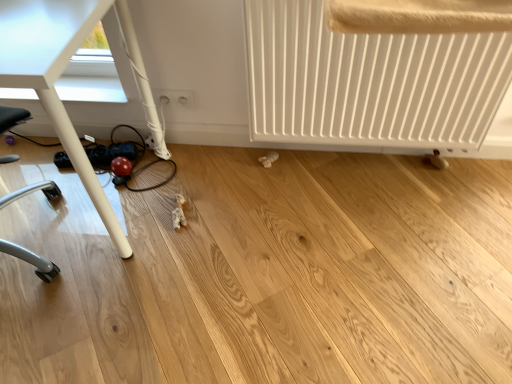
Measure the distance between point (89, 171) and camera.

The depth of point (89, 171) is 1.09 meters.

I want to click on white glossy table at lower left, so click(55, 76).

Can you confirm if white plastic outlets at lower center is positioned to the right of white matte radiator at lower right?

In fact, white plastic outlets at lower center is to the left of white matte radiator at lower right.

Identify the location of radiator that appears below the white plastic outlets at lower center (from the image's perspective). click(x=374, y=84).

Does point (169, 99) appear closer or farther from the camera than point (244, 7)?

Point (169, 99) is farther from the camera than point (244, 7).

Can you tell me how much white matte radiator at lower right and white glossy table at lower left differ in facing direction?

0.000121 degrees separate the facing orientations of white matte radiator at lower right and white glossy table at lower left.

Which object is further away from the camera taking this photo, white matte radiator at lower right or white glossy table at lower left?

white matte radiator at lower right is further from the camera.

Is white matte radiator at lower right aimed at white glossy table at lower left?

No, white matte radiator at lower right does not turn towards white glossy table at lower left.

In the scene shown: Is there a large distance between white matte radiator at lower right and white glossy table at lower left?

No, white matte radiator at lower right is in close proximity to white glossy table at lower left.

From their relative heights in the image, would you say white plastic outlets at lower center is taller or shorter than white glossy table at lower left?

white plastic outlets at lower center is shorter than white glossy table at lower left.

Which of these two, white plastic outlets at lower center or white glossy table at lower left, is smaller?

Smaller between the two is white plastic outlets at lower center.

Where is `electric outlet to the right of white glossy table at lower left`? This screenshot has height=384, width=512. electric outlet to the right of white glossy table at lower left is located at coordinates [175, 97].

Are white glossy table at lower left and white matte radiator at lower right located far from each other?

That's not correct — white glossy table at lower left is a little close to white matte radiator at lower right.

Considering the positions of objects white glossy table at lower left and white matte radiator at lower right in the image provided, who is behind, white glossy table at lower left or white matte radiator at lower right?

Positioned behind is white matte radiator at lower right.

From the image's perspective, is white glossy table at lower left beneath white matte radiator at lower right?

Correct, white glossy table at lower left appears lower than white matte radiator at lower right in the image.

Does point (46, 23) appear closer or farther from the camera than point (350, 119)?

Point (46, 23).

Between white matte radiator at lower right and white plastic outlets at lower center, which one has smaller size?

white plastic outlets at lower center is smaller.

From the picture: From the image's perspective, is white matte radiator at lower right located above or below white plastic outlets at lower center?

Based on their image positions, white matte radiator at lower right is located beneath white plastic outlets at lower center.

Would you say white matte radiator at lower right is to the left or to the right of white plastic outlets at lower center in the picture?

white matte radiator at lower right is to the right of white plastic outlets at lower center.

From a real-world perspective, is white matte radiator at lower right physically below white plastic outlets at lower center?

No, from a real-world perspective, white matte radiator at lower right is not below white plastic outlets at lower center.

Is white plastic outlets at lower center completely or partially inside white glossy table at lower left?

No, white plastic outlets at lower center is not surrounded by white glossy table at lower left.

Is white glossy table at lower left positioned far away from white plastic outlets at lower center?

No, white glossy table at lower left is in close proximity to white plastic outlets at lower center.

Is white glossy table at lower left turned away from white plastic outlets at lower center?

Correct, white glossy table at lower left is looking away from white plastic outlets at lower center.

I want to click on electric outlet that appears above the white matte radiator at lower right (from the image's perspective), so click(x=175, y=97).

Locate an element on the screen. The image size is (512, 384). table that appears above the white matte radiator at lower right (from a real-world perspective) is located at coordinates (55, 76).

In the scene shown: Based on their spatial positions, is white glossy table at lower left or white plastic outlets at lower center further from white matte radiator at lower right?

Among the two, white glossy table at lower left is located further to white matte radiator at lower right.

Looking at the image, which one is located closer to white plastic outlets at lower center, white glossy table at lower left or white matte radiator at lower right?

Among the two, white glossy table at lower left is located nearer to white plastic outlets at lower center.

Looking at the image, which one is located closer to white glossy table at lower left, white matte radiator at lower right or white plastic outlets at lower center?

white plastic outlets at lower center lies closer to white glossy table at lower left than the other object.

When comparing their distances from white glossy table at lower left, does white plastic outlets at lower center or white matte radiator at lower right seem further?

white matte radiator at lower right is further to white glossy table at lower left.

Considering their positions, is white matte radiator at lower right positioned closer to white plastic outlets at lower center than white glossy table at lower left?

Among the two, white glossy table at lower left is located nearer to white plastic outlets at lower center.

Based on their spatial positions, is white plastic outlets at lower center or white glossy table at lower left further from white matte radiator at lower right?

The object further to white matte radiator at lower right is white glossy table at lower left.

You are a GUI agent. You are given a task and a screenshot of the screen. Output one action in this format:
    pyautogui.click(x=<x>, y=<y>)
    Task: Click on the electric outlet between white glossy table at lower left and white matte radiator at lower right in the horizontal direction
    The image size is (512, 384).
    Given the screenshot: What is the action you would take?
    pyautogui.click(x=175, y=97)